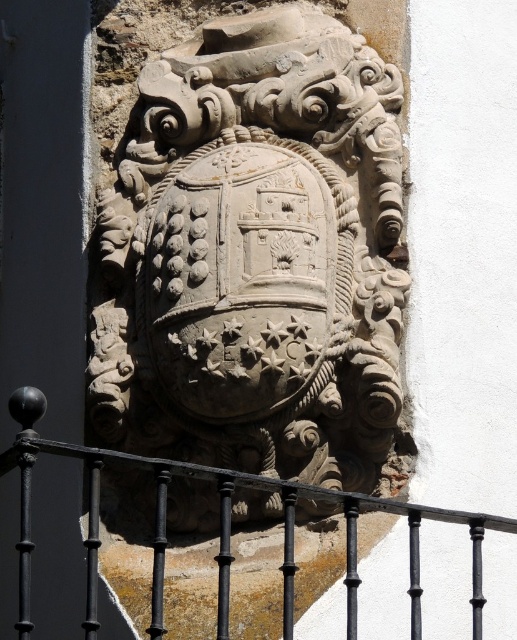
Looking at this image, you are an architect examining the building facade. You need to determine the spatial relationship between the carved stone shield at center and the black wrought iron at center. Which object is positioned in front of the other?

The carved stone shield at center is in front of the black wrought iron at center because the description states that the black wrought iron at center is behind the carved stone shield at center.

You are an architect examining the emblem on the building wall. You notice a specific point marked at coordinates (x=254, y=256). What object is located exactly at that point?

The carved stone shield at center is located exactly at point (x=254, y=256).

Based on the scene description, where is the carved stone shield at center located in the image?

The carved stone shield at center is located at point (254, 256).